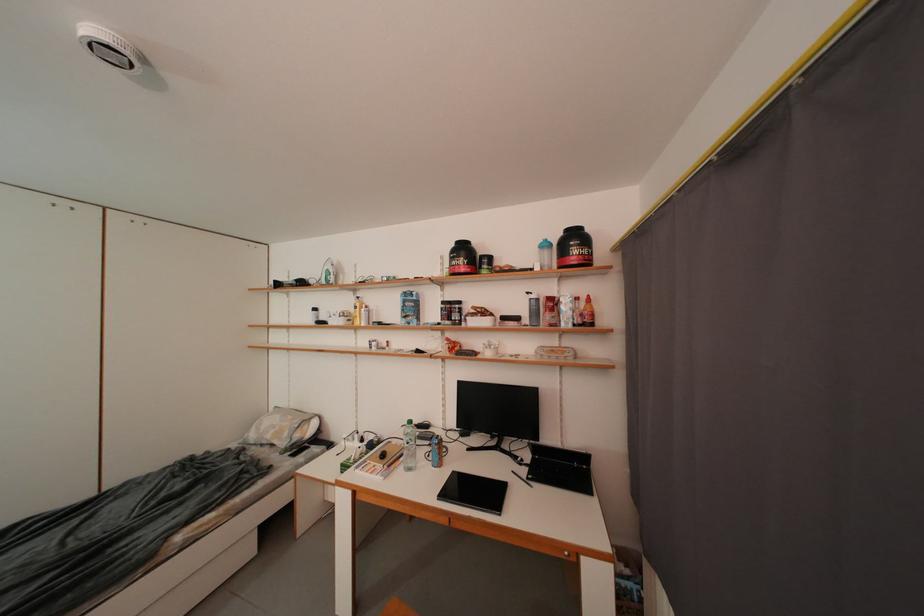
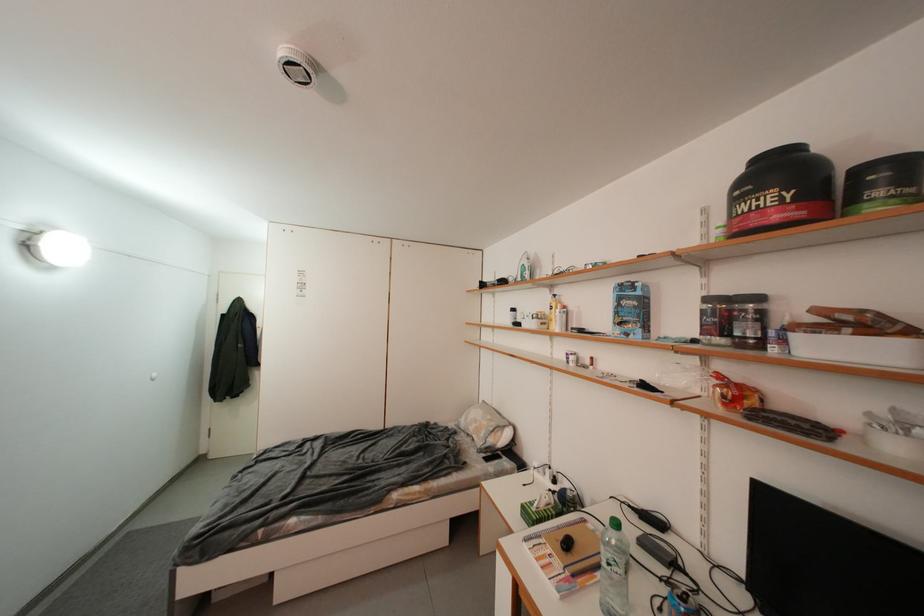
In the second image, find the point that corresponds to the point at 473,323 in the first image.

(792, 345)